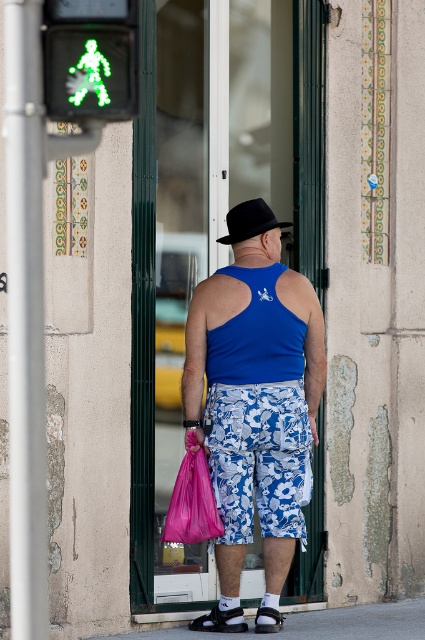
Question: Considering the real-world distances, which object is closest to the blue floral shorts at center?

Choices:
 (A) purple plastic bag at lower center
 (B) blue fabric tank top at center

Answer: (B)

Question: Which of these objects is positioned farthest from the blue floral shorts at center?

Choices:
 (A) green led pedestrian at upper left
 (B) blue fabric tank top at center
 (C) blue matte tank top at center

Answer: (A)

Question: Is blue floral shorts at center wider than purple plastic bag at lower center?

Choices:
 (A) no
 (B) yes

Answer: (B)

Question: Does green led pedestrian at upper left have a greater width compared to purple plastic bag at lower center?

Choices:
 (A) yes
 (B) no

Answer: (B)

Question: Is green led pedestrian at upper left positioned before blue matte tank top at center?

Choices:
 (A) no
 (B) yes

Answer: (B)

Question: Which point is farther to the camera?

Choices:
 (A) black felt hat at center
 (B) blue matte tank top at center
 (C) blue floral shorts at center

Answer: (A)